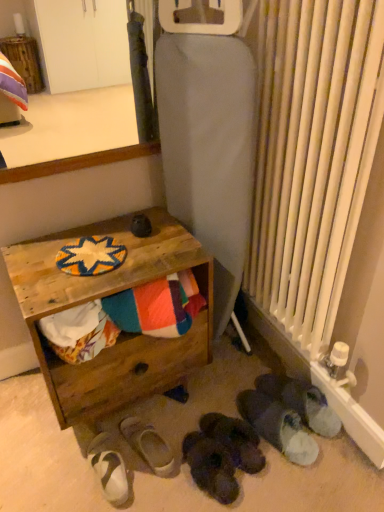
Image resolution: width=384 pixels, height=512 pixels. Find the location of `free space in front of dark gray fabric slippers at lower right, acting as the 6th footwear starting from the left`. free space in front of dark gray fabric slippers at lower right, acting as the 6th footwear starting from the left is located at coordinates (315, 474).